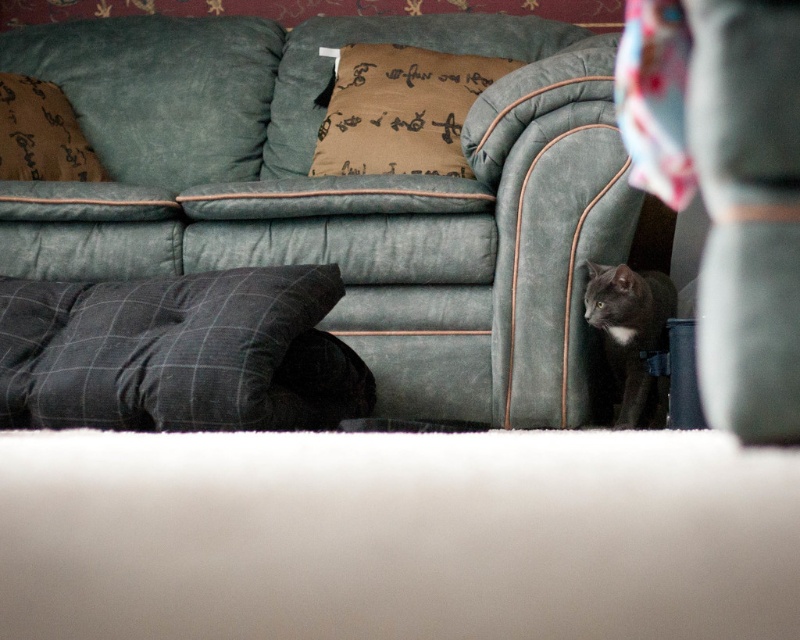
Question: Which object is positioned closest to the gray checkered pillow at lower left?

Choices:
 (A) black fur cat at lower right
 (B) suede-like gray cat at lower right
 (C) brown fabric pillow at upper center
 (D) brown textured pillow at upper left

Answer: (A)

Question: Can you confirm if brown fabric pillow at upper center is positioned below black fur cat at lower right?

Choices:
 (A) yes
 (B) no

Answer: (B)

Question: From the image, what is the correct spatial relationship of suede green couch at center in relation to black fur cat at lower right?

Choices:
 (A) right
 (B) left

Answer: (B)

Question: Which of the following is the closest to the observer?

Choices:
 (A) (242, 390)
 (B) (660, 388)
 (C) (337, 74)
 (D) (713, 0)

Answer: (D)

Question: Based on their relative distances, which object is nearer to the suede-like gray cat at lower right?

Choices:
 (A) black fur cat at lower right
 (B) gray checkered pillow at lower left

Answer: (B)

Question: In this image, where is suede-like gray cat at lower right located relative to brown textured pillow at upper left?

Choices:
 (A) right
 (B) left

Answer: (A)